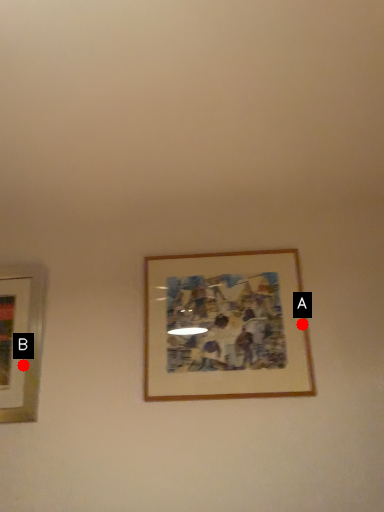
Question: Two points are circled on the image, labeled by A and B beside each circle. Among these points, which one is farthest from the camera?

Choices:
 (A) A is further
 (B) B is further

Answer: (B)